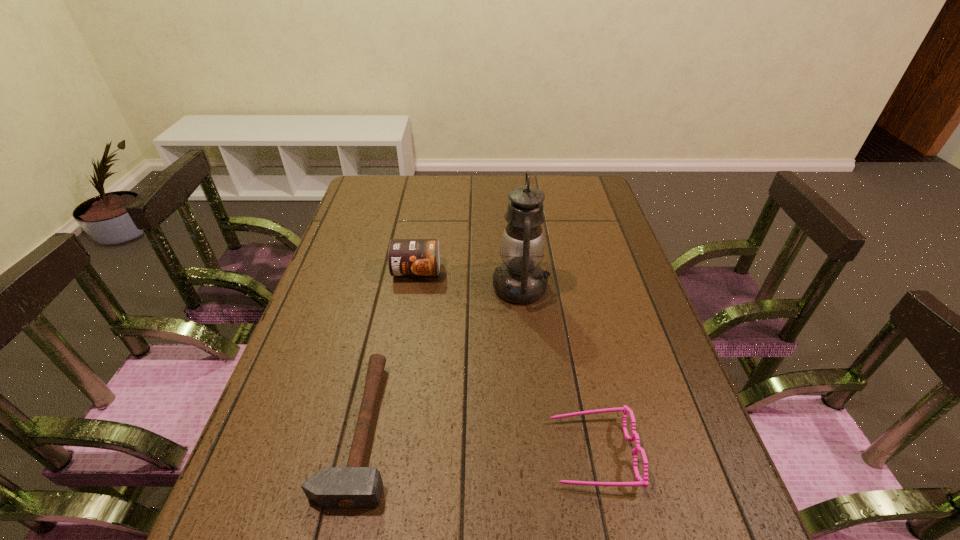
This screenshot has width=960, height=540. Identify the location of the tallest object. (520, 279).

Where is `the second tallest object`? the second tallest object is located at coordinates (406, 257).

Where is `spectacles`? The image size is (960, 540). spectacles is located at coordinates (643, 481).

What are the coordinates of `the shortest object` in the screenshot? It's located at (352, 487).

The image size is (960, 540). Find the location of `free space located on the back of the tallest object`. free space located on the back of the tallest object is located at coordinates (512, 195).

The width and height of the screenshot is (960, 540). Find the location of `free spot located on the front label of the third shortest object`. free spot located on the front label of the third shortest object is located at coordinates 407,330.

The width and height of the screenshot is (960, 540). I want to click on vacant area situated 0.240m on the arms of the spectacles, so click(434, 453).

Locate an element on the screen. Image resolution: width=960 pixels, height=540 pixels. vacant region located 0.060m on the arms of the spectacles is located at coordinates (523, 453).

The width and height of the screenshot is (960, 540). I want to click on free space located 0.270m on the arms of the spectacles, so click(419, 453).

This screenshot has width=960, height=540. I want to click on vacant area located 0.390m on the striking surface of the hammer, so click(x=579, y=429).